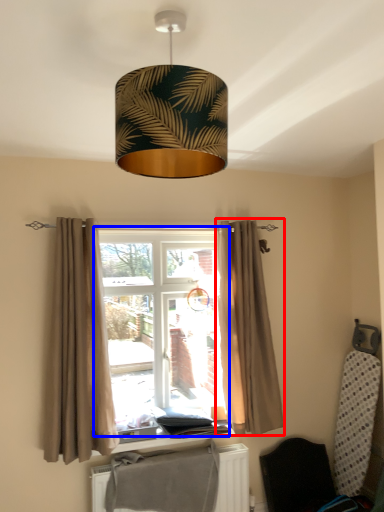
Question: Among these objects, which one is nearest to the camera, curtain (highlighted by a red box) or bay window (highlighted by a blue box)?

Choices:
 (A) curtain
 (B) bay window

Answer: (B)